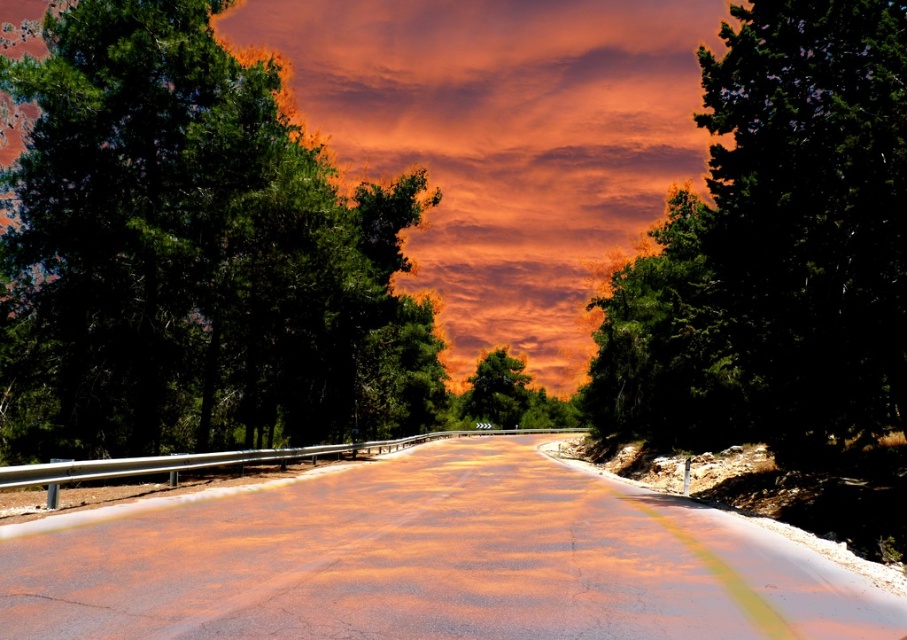
Is point (768, 52) in front of point (501, 356)?

Yes.

Is dark green textured tree at upper right to the left of green matte tree at center from the viewer's perspective?

Incorrect, dark green textured tree at upper right is not on the left side of green matte tree at center.

Is point (689, 387) positioned behind point (485, 394)?

No, (689, 387) is in front of (485, 394).

This screenshot has width=907, height=640. Find the location of `dark green textured tree at upper right`. dark green textured tree at upper right is located at coordinates (774, 244).

Does smooth asphalt road at center appear on the right side of orange cotton clouds at center?

Indeed, smooth asphalt road at center is positioned on the right side of orange cotton clouds at center.

Consider the image. Who is positioned more to the right, smooth asphalt road at center or orange cotton clouds at center?

Positioned to the right is smooth asphalt road at center.

Describe the element at coordinates (432, 563) in the screenshot. Image resolution: width=907 pixels, height=640 pixels. I see `smooth asphalt road at center` at that location.

Find the location of `smooth asphalt road at center`. smooth asphalt road at center is located at coordinates (432, 563).

Is green matte tree at left wider than smooth asphalt road at center?

Correct, the width of green matte tree at left exceeds that of smooth asphalt road at center.

Which is behind, point (148, 36) or point (587, 484)?

The point (587, 484) is behind.

Where is `green matte tree at left`? This screenshot has height=640, width=907. green matte tree at left is located at coordinates (193, 256).